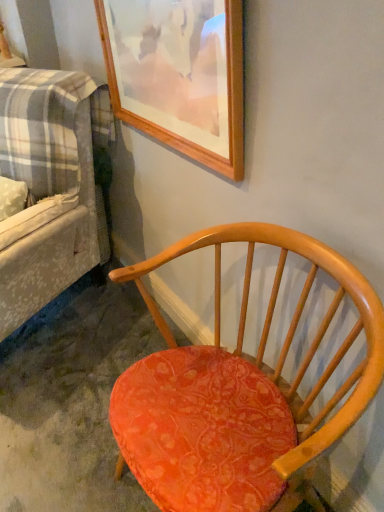
Question: Is plaid fabric couch at left taller or shorter than wooden picture frame at upper center?

Choices:
 (A) short
 (B) tall

Answer: (B)

Question: In terms of size, does plaid fabric couch at left appear bigger or smaller than wooden picture frame at upper center?

Choices:
 (A) big
 (B) small

Answer: (A)

Question: Which is farther from the plaid fabric couch at left?

Choices:
 (A) wooden picture frame at upper center
 (B) matte orange fabric chair at center

Answer: (B)

Question: Which of these objects is positioned farthest from the matte orange fabric chair at center?

Choices:
 (A) wooden picture frame at upper center
 (B) plaid fabric couch at left

Answer: (B)